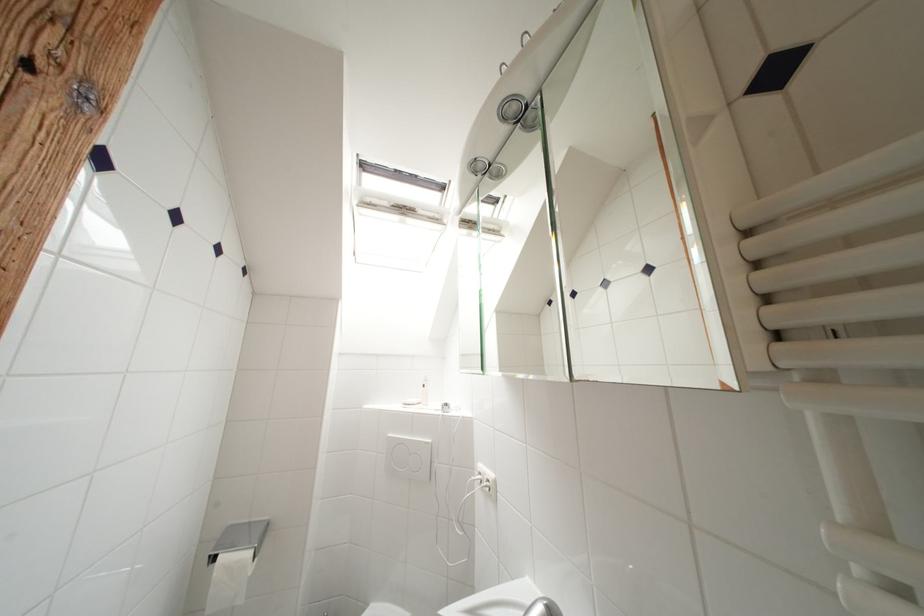
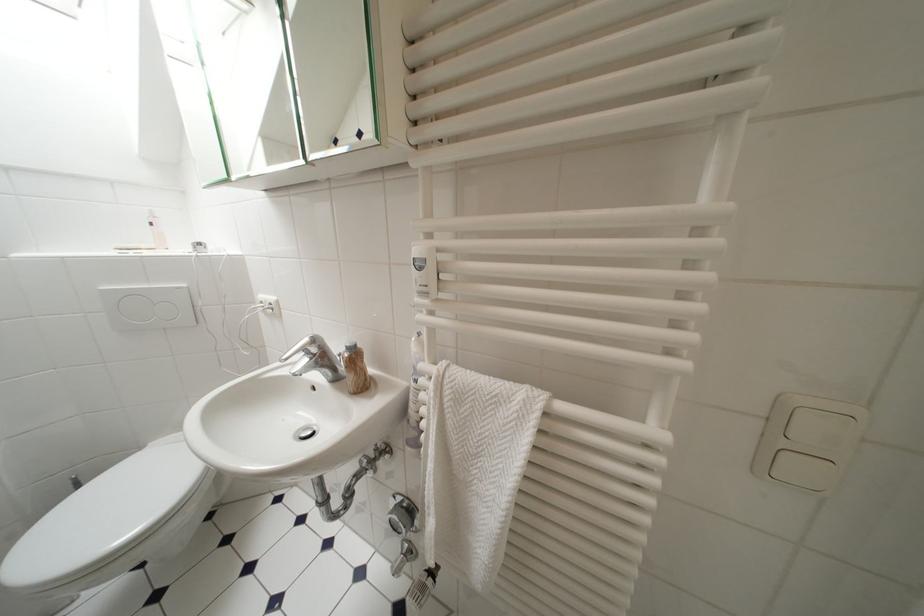
Where in the second image is the point corresponding to point 431,389 from the first image?

(159, 227)